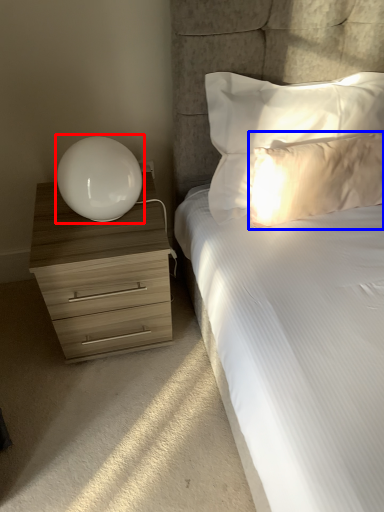
Question: Which point is further to the camera, table lamp (highlighted by a red box) or pillow (highlighted by a blue box)?

Choices:
 (A) table lamp
 (B) pillow

Answer: (B)